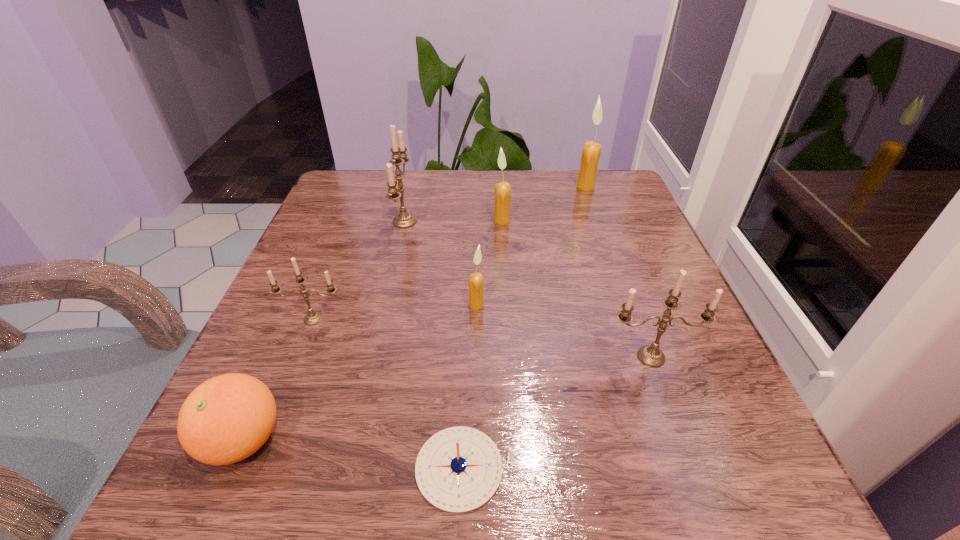
Where is `metallic candle that is the second closest to the second farthest cream candle`? metallic candle that is the second closest to the second farthest cream candle is located at coordinates (650, 355).

Select which metallic candle is the second closest to the farthest metallic candle. Please provide its 2D coordinates. Your answer should be formatted as a tuple, i.e. [(x, y)], where the tuple contains the x and y coordinates of a point satisfying the conditions above.

[(650, 355)]

At what (x,y) coordinates should I click in order to perform the action: click on the closest cream candle relative to the biggest cream candle. Please return your answer as a coordinate pair (x, y). Looking at the image, I should click on (502, 190).

Locate which cream candle is the second closest to the orange. Please provide its 2D coordinates. Your answer should be formatted as a tuple, i.e. [(x, y)], where the tuple contains the x and y coordinates of a point satisfying the conditions above.

[(502, 190)]

This screenshot has width=960, height=540. What are the coordinates of `free space in the image that satisfies the following two spatial constraints: 1. on the back side of the smallest cream candle; 2. on the left side of the second biggest cream candle` in the screenshot? It's located at (477, 220).